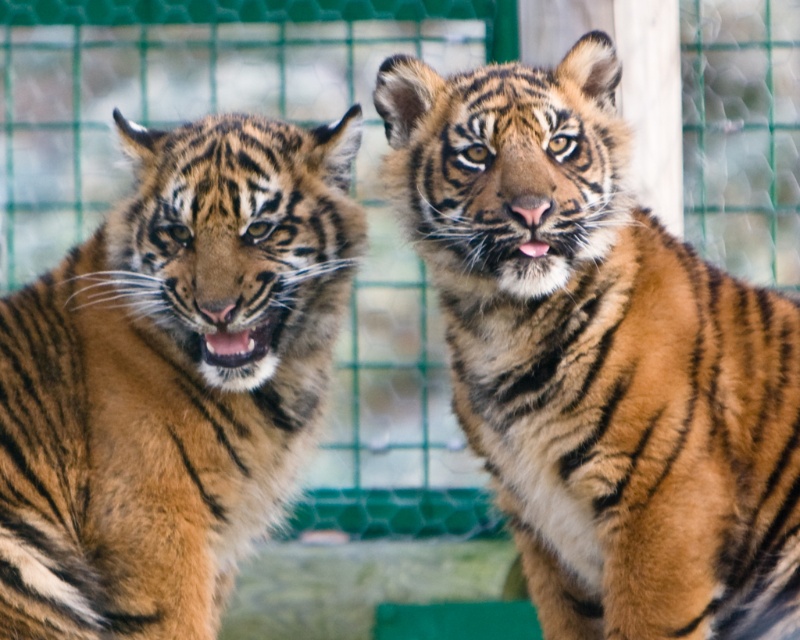
Question: Is orange-brown fur tiger at center in front of orange-brown fur tiger at left?

Choices:
 (A) yes
 (B) no

Answer: (A)

Question: Which point is farther to the camera?

Choices:
 (A) orange-brown fur tiger at left
 (B) orange-brown fur tiger at center

Answer: (A)

Question: From the image, what is the correct spatial relationship of orange-brown fur tiger at center in relation to orange-brown fur tiger at left?

Choices:
 (A) right
 (B) left

Answer: (A)

Question: Where is orange-brown fur tiger at center located in relation to orange-brown fur tiger at left in the image?

Choices:
 (A) above
 (B) below

Answer: (A)